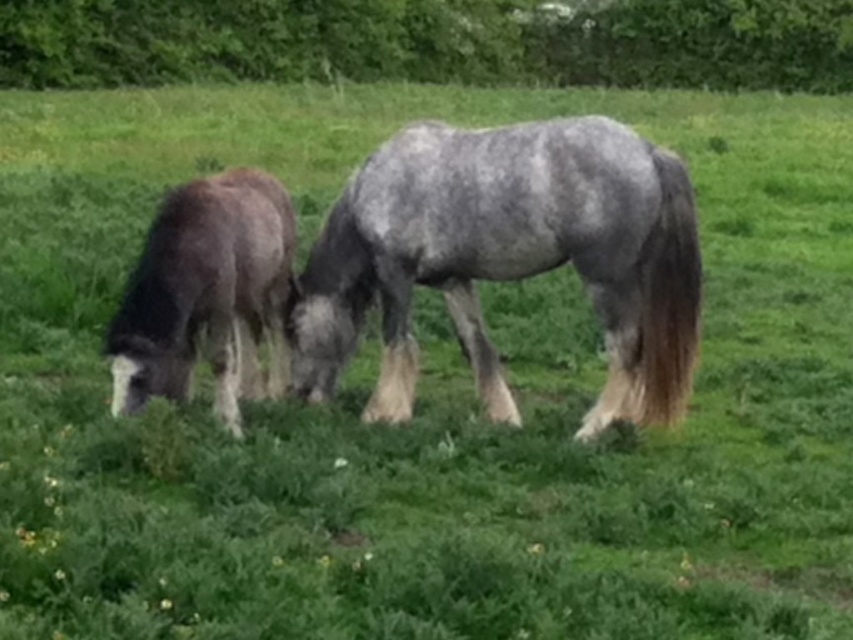
You are standing in the field and want to approach the speckled gray horse at center. Which direction should you walk to reach it from your current position at point (509, 259)?

The speckled gray horse at center is already at point (509, 259), so you are already at the correct location to approach it.

You are standing in the field and want to locate the speckled gray horse at center. According to the coordinates provided, where should you look?

The speckled gray horse at center is located at coordinates point (509, 259).

You are a farmer checking the field. You see the speckled gray horse at center and the dark brown fur at left. Which horse is closer to you?

The speckled gray horse at center is closer to you because it is positioned over the dark brown fur at left, indicating it is in front.